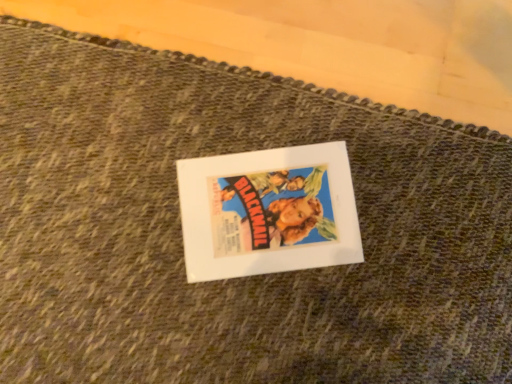
Where is `free spot behind white paper at center`? free spot behind white paper at center is located at coordinates (234, 110).